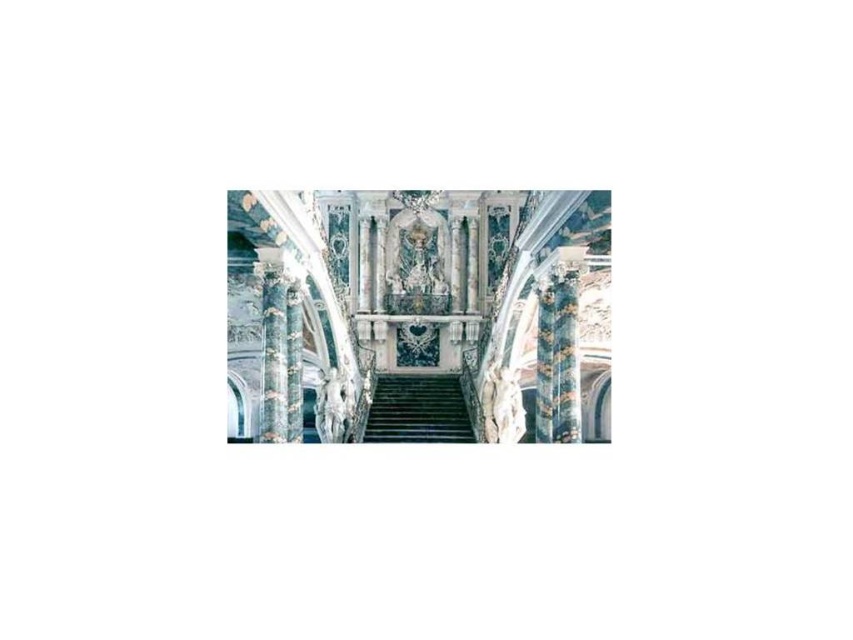
You are standing at the entrance of this grand space and want to reach the altar at the top of the white marble staircase at center. Which direction should you walk to approach the staircase?

You should walk towards the center of the space to approach the white marble staircase at center, as it is located at point coordinates approximately (421, 310).

You are an architect designing a new building and want to ensure proper sightlines for visitors approaching the altar. Given that the white marble staircase at center and the green marble stairs at center are both central features, which one would block the view of the other when viewed from the entrance?

The white marble staircase at center is in front of the green marble stairs at center, so the white marble staircase at center would block the view of the green marble stairs at center when viewed from the entrance.